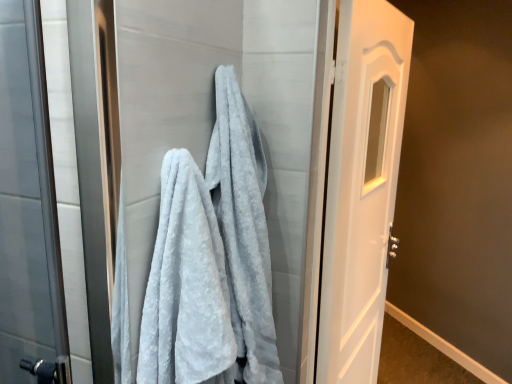
Question: Is gray fluffy towel at center further to the viewer compared to light gray fluffy towel at center?

Choices:
 (A) no
 (B) yes

Answer: (B)

Question: Considering the relative sizes of gray fluffy towel at center and light gray fluffy towel at center in the image provided, is gray fluffy towel at center bigger than light gray fluffy towel at center?

Choices:
 (A) yes
 (B) no

Answer: (A)

Question: Does gray fluffy towel at center have a smaller size compared to light gray fluffy towel at center?

Choices:
 (A) no
 (B) yes

Answer: (A)

Question: Does gray fluffy towel at center have a greater width compared to light gray fluffy towel at center?

Choices:
 (A) no
 (B) yes

Answer: (B)

Question: Is gray fluffy towel at center facing away from light gray fluffy towel at center?

Choices:
 (A) no
 (B) yes

Answer: (A)

Question: Does gray fluffy towel at center appear on the left side of light gray fluffy towel at center?

Choices:
 (A) no
 (B) yes

Answer: (A)

Question: From a real-world perspective, does light gray fluffy towel at center sit lower than gray fluffy towel at center?

Choices:
 (A) no
 (B) yes

Answer: (A)

Question: Can you confirm if light gray fluffy towel at center is wider than gray fluffy towel at center?

Choices:
 (A) yes
 (B) no

Answer: (B)

Question: From the image's perspective, is light gray fluffy towel at center below gray fluffy towel at center?

Choices:
 (A) no
 (B) yes

Answer: (B)

Question: Considering the relative positions of light gray fluffy towel at center and gray fluffy towel at center in the image provided, is light gray fluffy towel at center to the right of gray fluffy towel at center from the viewer's perspective?

Choices:
 (A) yes
 (B) no

Answer: (B)

Question: Considering the relative sizes of light gray fluffy towel at center and gray fluffy towel at center in the image provided, is light gray fluffy towel at center taller than gray fluffy towel at center?

Choices:
 (A) yes
 (B) no

Answer: (B)

Question: Are light gray fluffy towel at center and gray fluffy towel at center beside each other?

Choices:
 (A) no
 (B) yes

Answer: (A)

Question: Is white glossy door at right outside of gray fluffy towel at center?

Choices:
 (A) yes
 (B) no

Answer: (A)